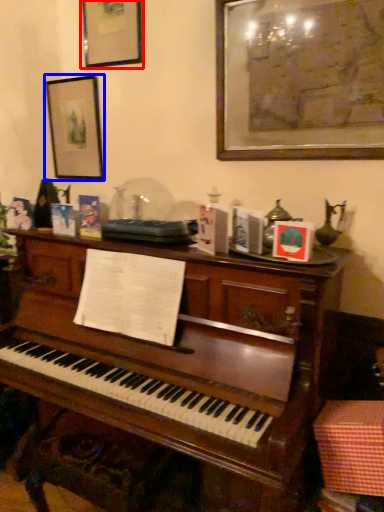
Question: Which object appears closest to the camera in this image, picture frame (highlighted by a red box) or picture frame (highlighted by a blue box)?

Choices:
 (A) picture frame
 (B) picture frame

Answer: (A)